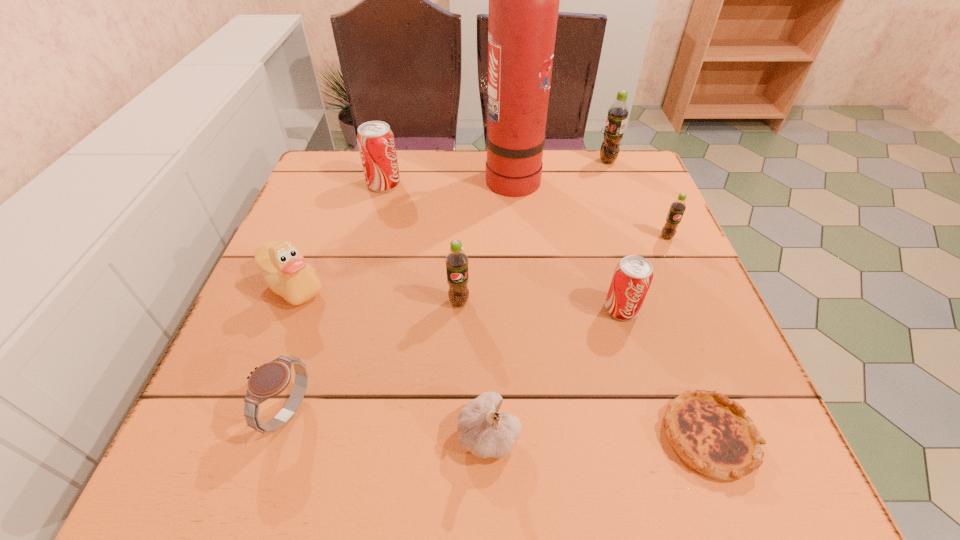
You are a GUI agent. You are given a task and a screenshot of the screen. Output one action in this format:
    pyautogui.click(x=<x>, y=<y>)
    Task: Click on the garlic positioned at the near edge
    The width and height of the screenshot is (960, 540).
    Given the screenshot: What is the action you would take?
    pyautogui.click(x=483, y=431)

You are a GUI agent. You are given a task and a screenshot of the screen. Output one action in this format:
    pyautogui.click(x=<x>, y=<y>)
    Task: Click on the watch located in the near edge section of the desktop
    
    Given the screenshot: What is the action you would take?
    pyautogui.click(x=268, y=380)

The width and height of the screenshot is (960, 540). In order to click on quiche present at the near edge in this screenshot , I will do `click(712, 434)`.

In order to click on soda can positioned at the left edge in this screenshot , I will do `click(376, 144)`.

Identify the location of duck present at the left edge. The image size is (960, 540). (282, 265).

The height and width of the screenshot is (540, 960). I want to click on watch at the left edge, so (268, 380).

Find the location of a particular element. quiche situated at the right edge is located at coordinates point(712,434).

Where is `object present at the far left corner`? The image size is (960, 540). object present at the far left corner is located at coordinates (376, 144).

Find the location of `object positioned at the near left corner`. object positioned at the near left corner is located at coordinates (268, 380).

Where is `object positioned at the far right corner`? object positioned at the far right corner is located at coordinates (613, 134).